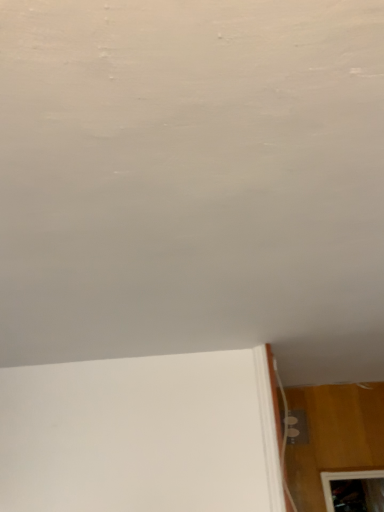
Question: In terms of height, does white matte wall at upper center look taller or shorter compared to white glossy electric outlet at lower right?

Choices:
 (A) tall
 (B) short

Answer: (B)

Question: Looking at their shapes, would you say white matte wall at upper center is wider or thinner than white glossy electric outlet at lower right?

Choices:
 (A) wide
 (B) thin

Answer: (A)

Question: Considering the positions of point (344, 335) and point (289, 420), is point (344, 335) closer or farther from the camera than point (289, 420)?

Choices:
 (A) farther
 (B) closer

Answer: (B)

Question: In the image, is white glossy electric outlet at lower right positioned in front of or behind white matte wall at upper center?

Choices:
 (A) front
 (B) behind

Answer: (B)

Question: From a real-world perspective, relative to white matte wall at upper center, is white glossy electric outlet at lower right vertically above or below?

Choices:
 (A) below
 (B) above

Answer: (A)

Question: In the image, is white glossy electric outlet at lower right on the left side or the right side of white matte wall at upper center?

Choices:
 (A) right
 (B) left

Answer: (A)

Question: Is white glossy electric outlet at lower right wider or thinner than white matte wall at upper center?

Choices:
 (A) wide
 (B) thin

Answer: (B)